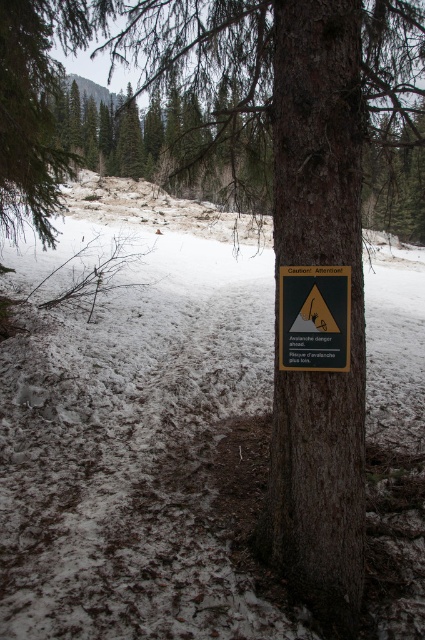
Question: Can you confirm if white powdery snow at center is positioned to the right of green plastic sign at center?

Choices:
 (A) no
 (B) yes

Answer: (A)

Question: Which point is farther to the camera?

Choices:
 (A) (224, 532)
 (B) (346, 337)

Answer: (A)

Question: Which point is closer to the camera?

Choices:
 (A) (232, 272)
 (B) (312, 268)

Answer: (B)

Question: Does white powdery snow at center have a lesser width compared to green plastic sign at center?

Choices:
 (A) no
 (B) yes

Answer: (A)

Question: Does white powdery snow at center have a larger size compared to green plastic sign at center?

Choices:
 (A) yes
 (B) no

Answer: (A)